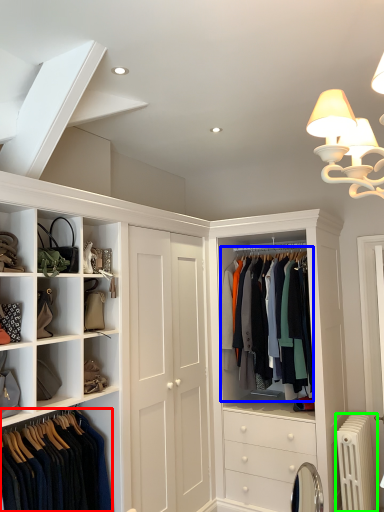
Question: Which object is positioned farthest from clothing (highlighted by a red box)? Select from clothing (highlighted by a blue box) and radiator (highlighted by a green box).

Choices:
 (A) clothing
 (B) radiator

Answer: (B)